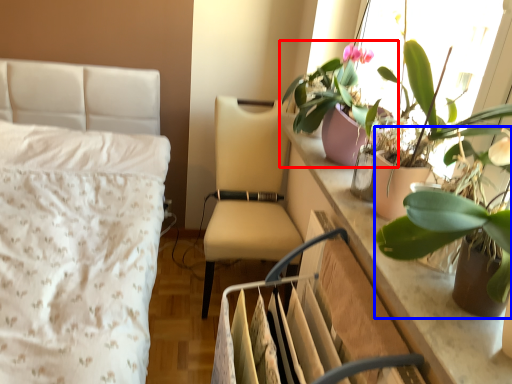
Question: Which object appears closest to the camera in this image, houseplant (highlighted by a red box) or houseplant (highlighted by a blue box)?

Choices:
 (A) houseplant
 (B) houseplant

Answer: (B)